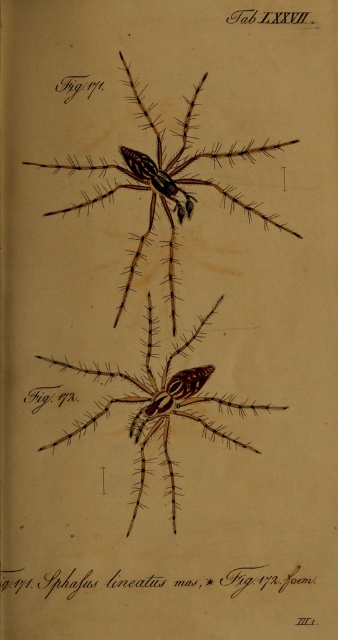
The image size is (338, 640). What do you see at coordinates (163, 184) in the screenshot? I see `brown textured spider at center` at bounding box center [163, 184].

Can you confirm if brown textured spider at center is positioned below brown matte spider at center?

Actually, brown textured spider at center is above brown matte spider at center.

Where is `brown textured spider at center`? This screenshot has width=338, height=640. brown textured spider at center is located at coordinates click(163, 184).

At what (x,y) coordinates should I click in order to perform the action: click on brown textured spider at center. Please return your answer as a coordinate pair (x, y). Looking at the image, I should click on (163, 184).